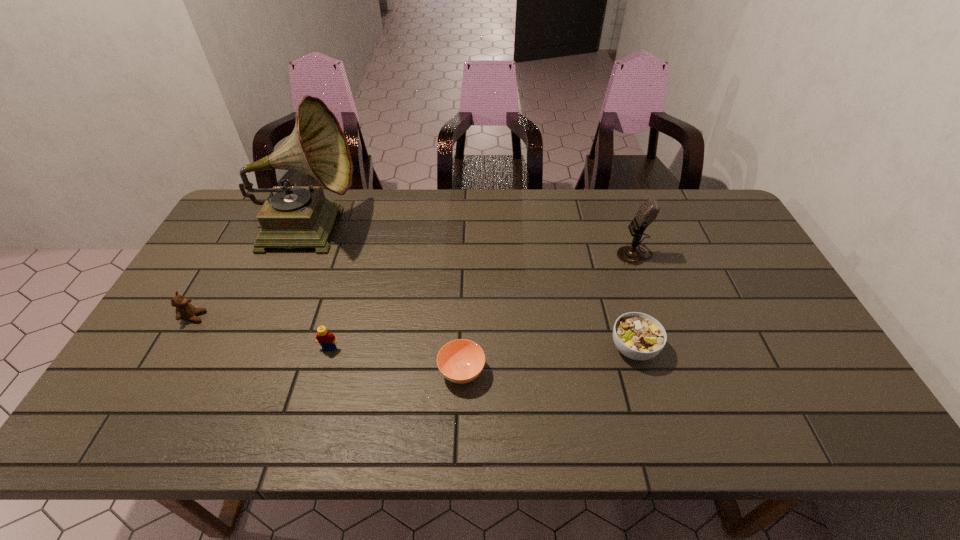
Identify the location of vacant space located 0.300m on the front-facing side of the second tallest object. Image resolution: width=960 pixels, height=540 pixels. (520, 253).

Identify the location of vacant space located 0.150m on the front-facing side of the second tallest object. (568, 253).

In order to click on vacant region located on the front-facing side of the second tallest object in this screenshot , I will do `click(552, 253)`.

Image resolution: width=960 pixels, height=540 pixels. Identify the location of free point located 0.110m at the face of the third farthest object. (245, 317).

The image size is (960, 540). I want to click on free space located 0.100m on the front-facing side of the Lego, so 318,387.

Where is `vacant space located 0.170m on the left of the taller soup bowl`? This screenshot has height=540, width=960. vacant space located 0.170m on the left of the taller soup bowl is located at coordinates (542, 348).

This screenshot has height=540, width=960. What are the coordinates of `vacant space located on the left of the left soup bowl` in the screenshot? It's located at (275, 372).

Find the location of a particular element. Image resolution: width=960 pixels, height=540 pixels. object at the far edge is located at coordinates (291, 217).

This screenshot has width=960, height=540. I want to click on record player at the left edge, so click(291, 217).

At what (x,y) coordinates should I click in order to perform the action: click on teddy bear located in the left edge section of the desktop. Please return your answer as a coordinate pair (x, y). Image resolution: width=960 pixels, height=540 pixels. Looking at the image, I should click on (184, 310).